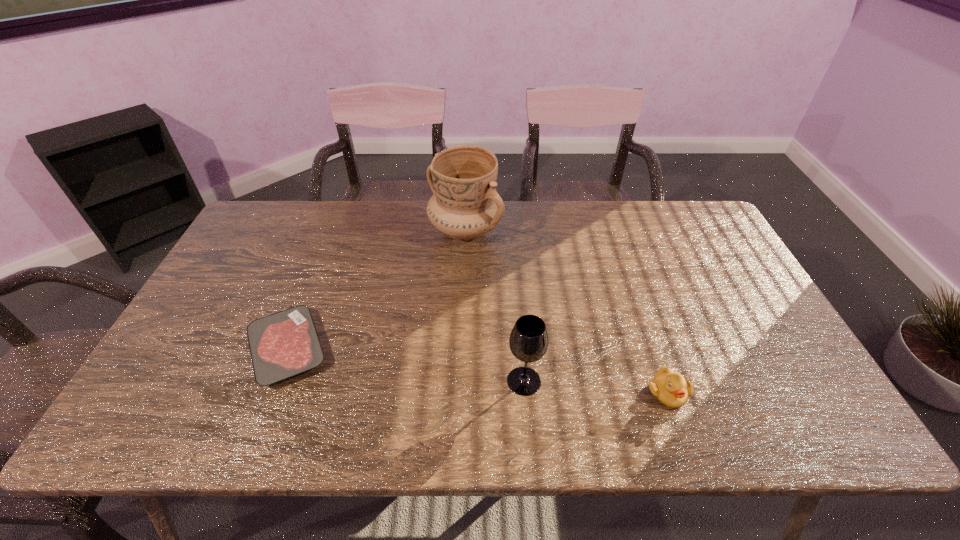
Locate an element on the screen. Image resolution: width=960 pixels, height=540 pixels. the farthest object is located at coordinates (465, 205).

Where is `pottery`? pottery is located at coordinates (465, 205).

You are a GUI agent. You are given a task and a screenshot of the screen. Output one action in this format:
    pyautogui.click(x=<x>, y=<y>)
    Task: Click on the wineglass
    
    Given the screenshot: What is the action you would take?
    pyautogui.click(x=528, y=341)

The height and width of the screenshot is (540, 960). Identify the location of duckling. (670, 388).

At what (x,y) coordinates should I click in order to perform the action: click on the second shortest object. Please return your answer as a coordinate pair (x, y). The height and width of the screenshot is (540, 960). Looking at the image, I should click on (x=670, y=388).

Where is `steak`? Image resolution: width=960 pixels, height=540 pixels. steak is located at coordinates (284, 344).

In order to click on the shortest object in this screenshot , I will do `click(284, 344)`.

You are a GUI agent. You are given a task and a screenshot of the screen. Output one action in this format:
    pyautogui.click(x=<x>, y=<y>)
    Task: Click on the vacant area located on the front of the tallest object
    The width and height of the screenshot is (960, 540).
    Given the screenshot: What is the action you would take?
    pyautogui.click(x=460, y=361)

Identify the location of free space located on the right of the third shortest object. (580, 381).

Find the location of `vacant space located at the beak of the second shortest object`. vacant space located at the beak of the second shortest object is located at coordinates (681, 432).